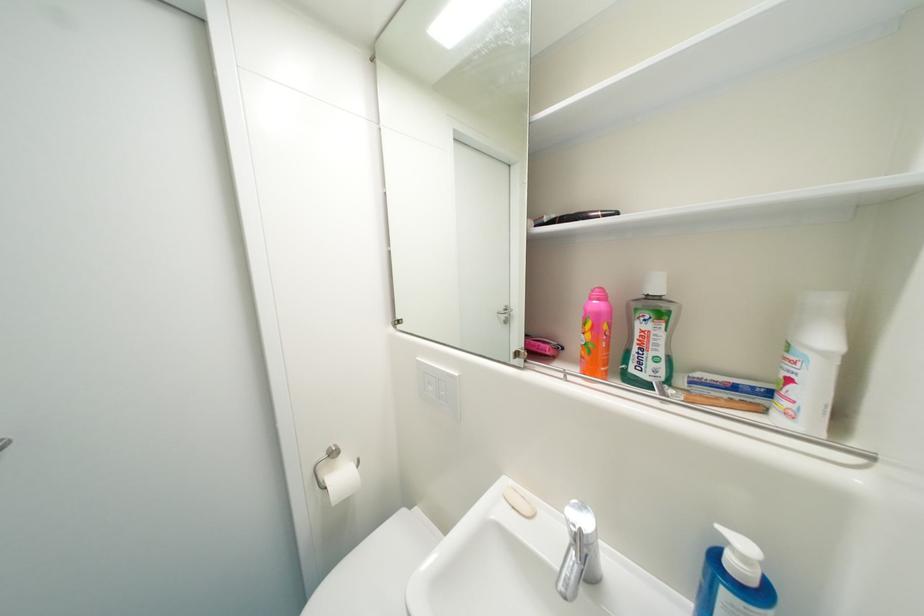
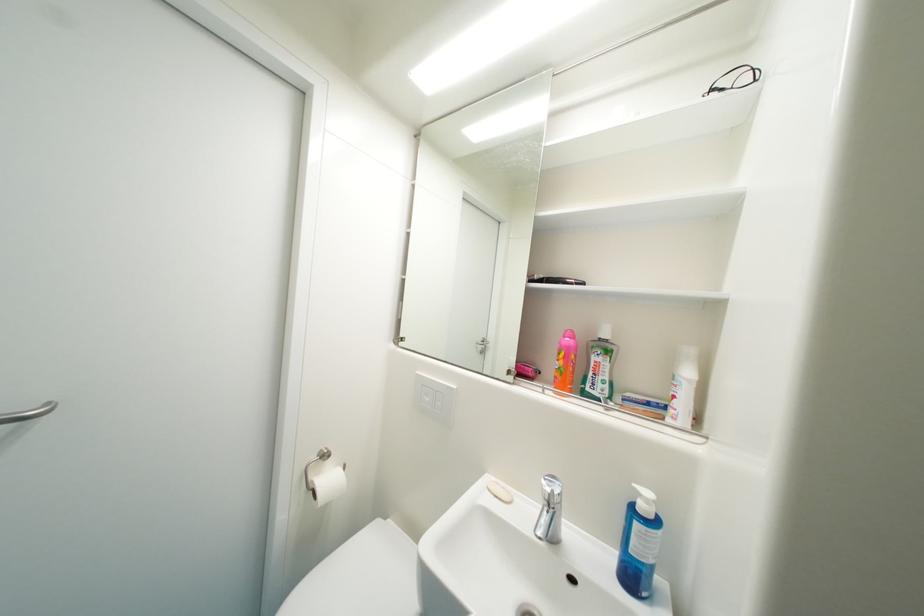
Locate, in the second image, the point that corresponds to (x=438, y=390) in the first image.

(433, 400)